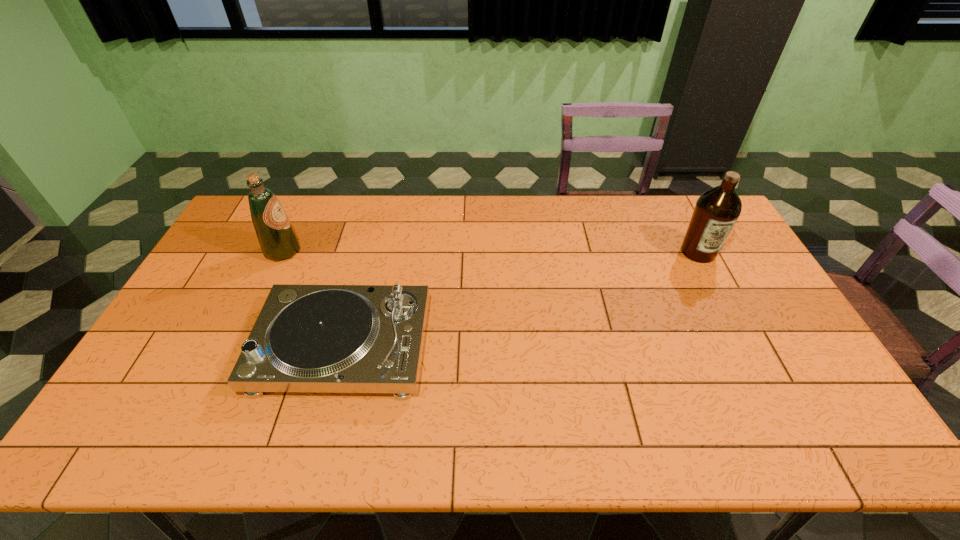
The image size is (960, 540). I want to click on free region at the near edge of the desktop, so click(281, 424).

Locate an element on the screen. Image resolution: width=960 pixels, height=540 pixels. vacant space at the right edge of the desktop is located at coordinates (745, 311).

In the image, there is a desktop. At what (x,y) coordinates should I click in order to perform the action: click on free space at the far right corner. Please return your answer as a coordinate pair (x, y). Looking at the image, I should click on (685, 194).

In order to click on free space between the nearest object and the rightmost object in this screenshot , I will do `click(520, 299)`.

The height and width of the screenshot is (540, 960). Find the location of `empty location between the rightmost object and the record player`. empty location between the rightmost object and the record player is located at coordinates (520, 299).

At what (x,y) coordinates should I click in order to perform the action: click on empty location between the left olive oil and the rightmost object. Please return your answer as a coordinate pair (x, y). This screenshot has width=960, height=540. Looking at the image, I should click on (491, 252).

At what (x,y) coordinates should I click in order to perform the action: click on unoccupied area between the rightmost object and the nearest object. Please return your answer as a coordinate pair (x, y). Looking at the image, I should click on (520, 299).

At what (x,y) coordinates should I click in order to perform the action: click on vacant space that is in between the rightmost object and the left olive oil. Please return your answer as a coordinate pair (x, y). Image resolution: width=960 pixels, height=540 pixels. Looking at the image, I should click on (491, 252).

Find the location of `vacant area that lies between the right olive oil and the shortest object`. vacant area that lies between the right olive oil and the shortest object is located at coordinates (520, 299).

Locate an element on the screen. The width and height of the screenshot is (960, 540). free area in between the left olive oil and the rightmost object is located at coordinates (491, 252).